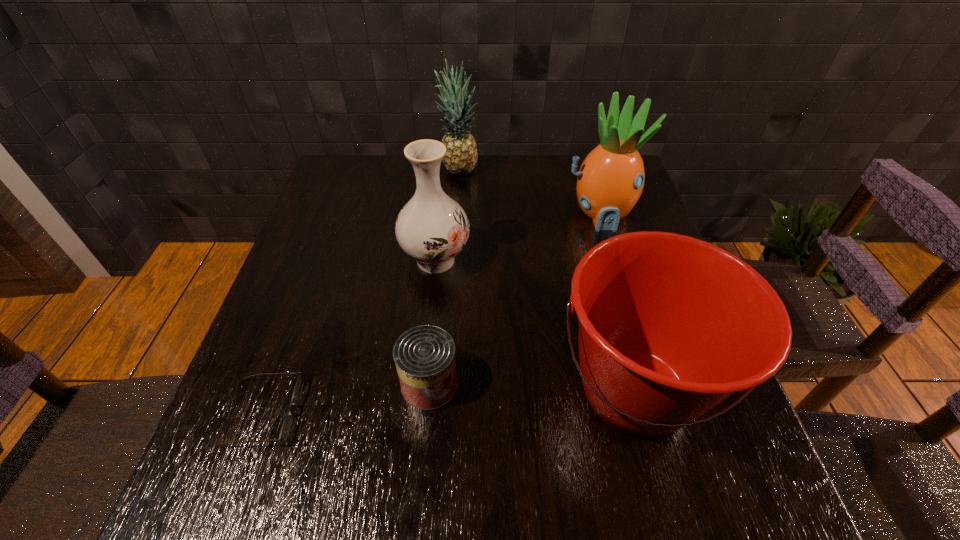
Locate an element on the screen. Image resolution: width=960 pixels, height=540 pixels. vacant space located at the entrance of the right pineapple is located at coordinates (638, 342).

Image resolution: width=960 pixels, height=540 pixels. I want to click on vacant area located 0.090m on the right of the vase, so click(x=507, y=260).

I want to click on free region located 0.060m with the handle attached to the rim of the bucket, so click(667, 512).

The image size is (960, 540). In order to click on vacant space situated 0.180m on the right of the can in this screenshot , I will do click(x=551, y=384).

The image size is (960, 540). Find the location of `blank area located on the front-facing side of the leftmost object`. blank area located on the front-facing side of the leftmost object is located at coordinates (476, 412).

Where is `object at the near edge`? object at the near edge is located at coordinates (670, 326).

Identify the location of object at the left edge. This screenshot has height=540, width=960. (287, 422).

Find the location of a particular element. This screenshot has width=960, height=540. pineapple present at the right edge is located at coordinates (610, 181).

In order to click on bucket at the right edge in this screenshot , I will do `click(670, 326)`.

You are a GUI agent. You are given a task and a screenshot of the screen. Output one action in this format:
    pyautogui.click(x=<x>, y=<y>)
    Task: Click on the object at the far right corner
    Image resolution: width=960 pixels, height=540 pixels.
    Given the screenshot: What is the action you would take?
    pyautogui.click(x=610, y=181)